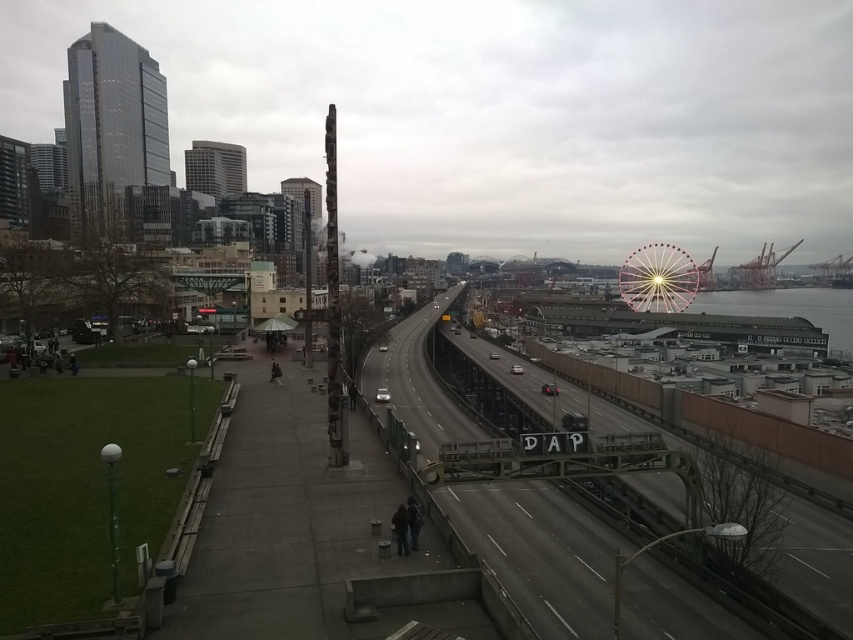
Question: Can you confirm if metallic gray train track at center is smaller than pink metallic ferris wheel at upper right?

Choices:
 (A) no
 (B) yes

Answer: (A)

Question: Is metallic gray train track at center thinner than pink metallic ferris wheel at upper right?

Choices:
 (A) no
 (B) yes

Answer: (A)

Question: Observing the image, what is the correct spatial positioning of metallic gray train track at center in reference to pink metallic ferris wheel at upper right?

Choices:
 (A) below
 (B) above

Answer: (A)

Question: Among these objects, which one is farthest from the camera?

Choices:
 (A) metallic gray train track at center
 (B) pink metallic ferris wheel at upper right

Answer: (B)